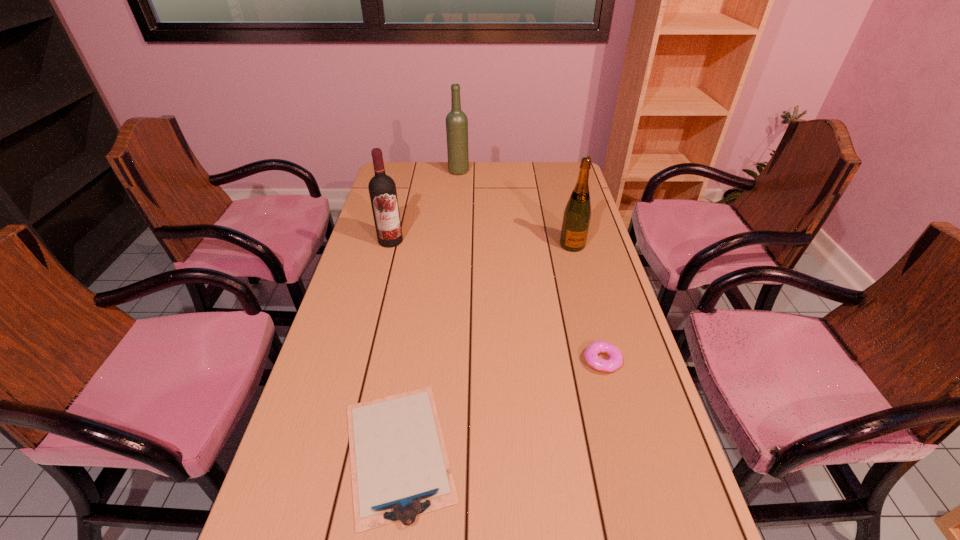
Find the location of a particular element. Image resolution: width=960 pixels, height=540 pixels. free spot between the second shortest object and the farthest wine bottle is located at coordinates (531, 266).

Select which object appears as the second closest to the leftmost wine bottle. Please provide its 2D coordinates. Your answer should be formatted as a tuple, i.e. [(x, y)], where the tuple contains the x and y coordinates of a point satisfying the conditions above.

[(576, 219)]

You are a GUI agent. You are given a task and a screenshot of the screen. Output one action in this format:
    pyautogui.click(x=<x>, y=<y>)
    Task: Click on the object that is the fourth closest to the nearest object
    
    Given the screenshot: What is the action you would take?
    pyautogui.click(x=456, y=121)

Locate which wine bottle is the closest to the farthest object. Please provide its 2D coordinates. Your answer should be formatted as a tuple, i.e. [(x, y)], where the tuple contains the x and y coordinates of a point satisfying the conditions above.

[(382, 189)]

Identify which wine bottle is the second nearest to the doughnut. Please provide its 2D coordinates. Your answer should be formatted as a tuple, i.e. [(x, y)], where the tuple contains the x and y coordinates of a point satisfying the conditions above.

[(382, 189)]

You are a GUI agent. You are given a task and a screenshot of the screen. Output one action in this format:
    pyautogui.click(x=<x>, y=<y>)
    Task: Click on the free location that satisfies the following two spatial constraints: 1. on the label of the doughnut; 2. on the right side of the leftmost wine bottle
    
    Given the screenshot: What is the action you would take?
    pyautogui.click(x=360, y=361)